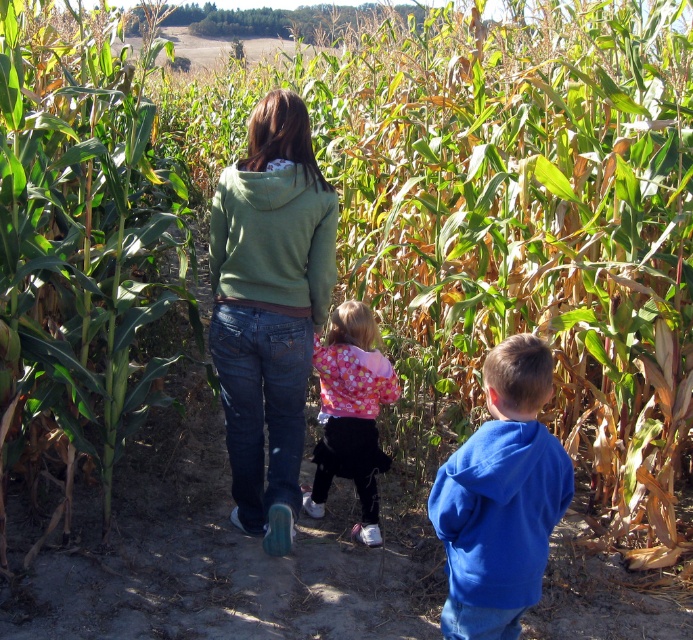
Question: Among these points, which one is nearest to the camera?

Choices:
 (A) (365, 492)
 (B) (297, 112)

Answer: (B)

Question: In this image, where is green matte hoodie at center located relative to fluffy pink sweater at center?

Choices:
 (A) right
 (B) left

Answer: (B)

Question: Is blue fleece jacket at center thinner than green matte sweatshirt at center?

Choices:
 (A) no
 (B) yes

Answer: (B)

Question: Does blue fleece jacket at center have a larger size compared to green matte sweatshirt at center?

Choices:
 (A) yes
 (B) no

Answer: (A)

Question: Which point is closer to the camera?

Choices:
 (A) (367, 458)
 (B) (243, 301)
 (C) (471, 637)

Answer: (C)

Question: Which is nearer to the green matte hoodie at center?

Choices:
 (A) green matte sweatshirt at center
 (B) blue fleece jacket at center

Answer: (A)